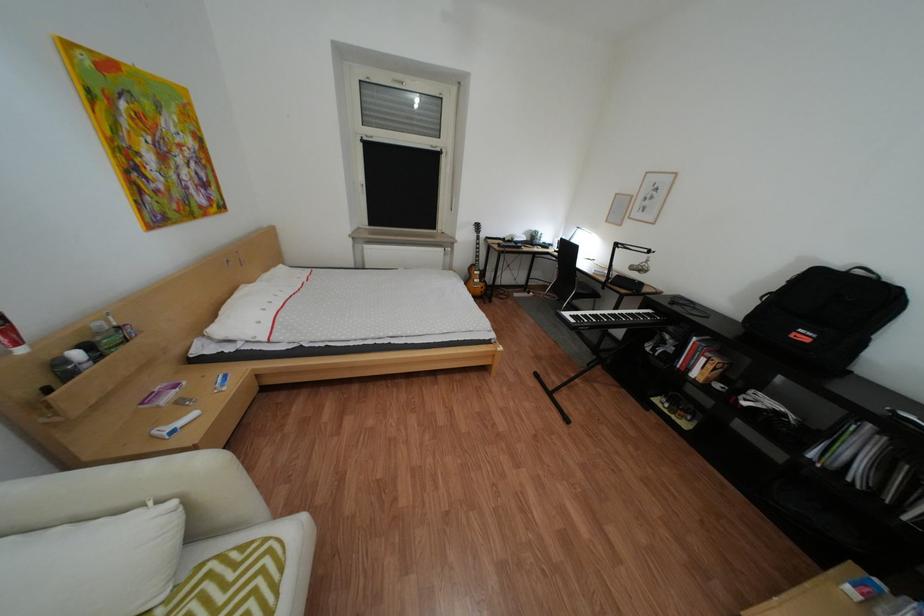
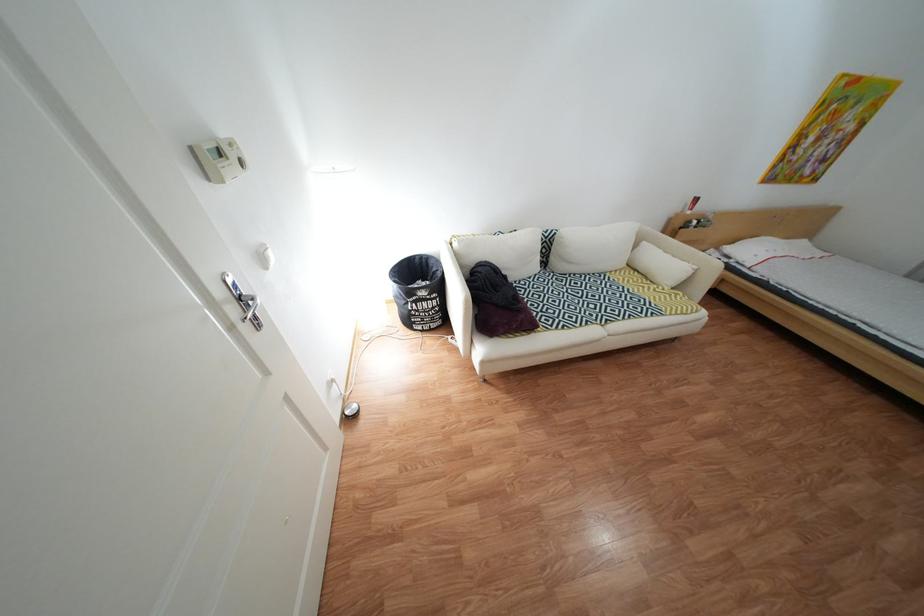
Where in the second image is the point corresponding to the point at 234,331 from the first image?

(744, 249)